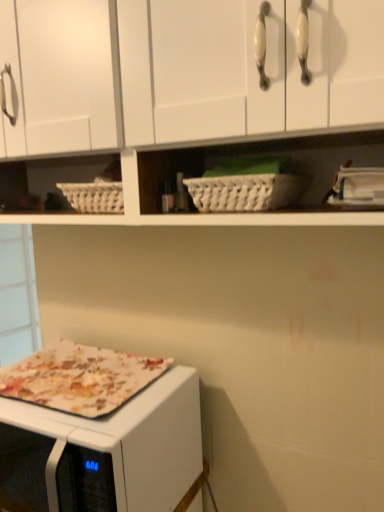
Question: Is white matte cabinet at upper center inside or outside of printed fabric pizza at lower left?

Choices:
 (A) outside
 (B) inside

Answer: (A)

Question: From a real-world perspective, is white matte cabinet at upper center physically located above or below printed fabric pizza at lower left?

Choices:
 (A) above
 (B) below

Answer: (A)

Question: Which object is positioned closest to the white matte cabinet at upper center?

Choices:
 (A) printed fabric pizza at lower left
 (B) floral fabric microwave oven at lower left
 (C) white wicker basket at center

Answer: (C)

Question: Considering the real-world distances, which object is closest to the white matte cabinet at upper center?

Choices:
 (A) printed fabric pizza at lower left
 (B) white wicker basket at center
 (C) floral fabric microwave oven at lower left

Answer: (B)